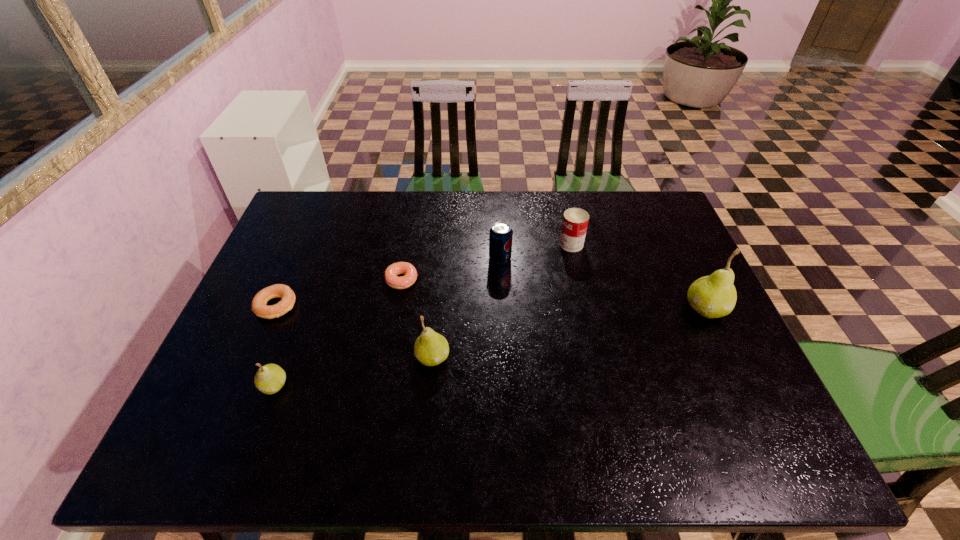
To achieve even spacing by inserting another pear among them, please point to a vacant spot for this new pear. Please provide its 2D coordinates. Your answer should be formatted as a tuple, i.e. [(x, y)], where the tuple contains the x and y coordinates of a point satisfying the conditions above.

[(576, 332)]